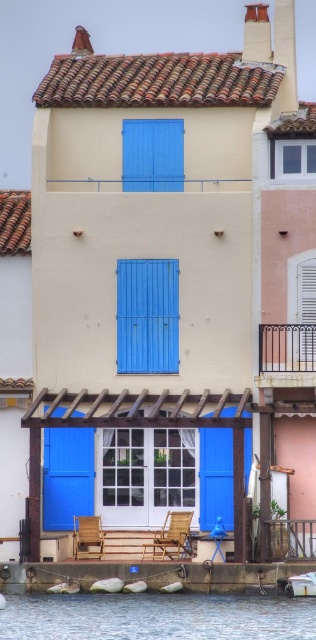
Question: Considering the relative positions of clear glass window at upper right and white wood shutter at upper right in the image provided, where is clear glass window at upper right located with respect to white wood shutter at upper right?

Choices:
 (A) left
 (B) right

Answer: (A)

Question: Among these points, which one is nearest to the camera?

Choices:
 (A) (290, 163)
 (B) (301, 337)
 (C) (72, 506)
 (D) (310, 592)

Answer: (D)

Question: Is blue painted wood window at center above clear glass window at upper right?

Choices:
 (A) yes
 (B) no

Answer: (B)

Question: Can you confirm if clear water at lower center is smaller than blue painted wood shutter at upper center?

Choices:
 (A) no
 (B) yes

Answer: (A)

Question: Considering the real-world distances, which object is closest to the white plastic boat at lower center?

Choices:
 (A) clear glass window at upper right
 (B) blue painted wood window at center
 (C) white wood shutter at upper right

Answer: (C)

Question: Which point appears closest to the camera in this image?

Choices:
 (A) (101, 548)
 (B) (308, 264)
 (C) (309, 156)
 (D) (168, 515)

Answer: (A)